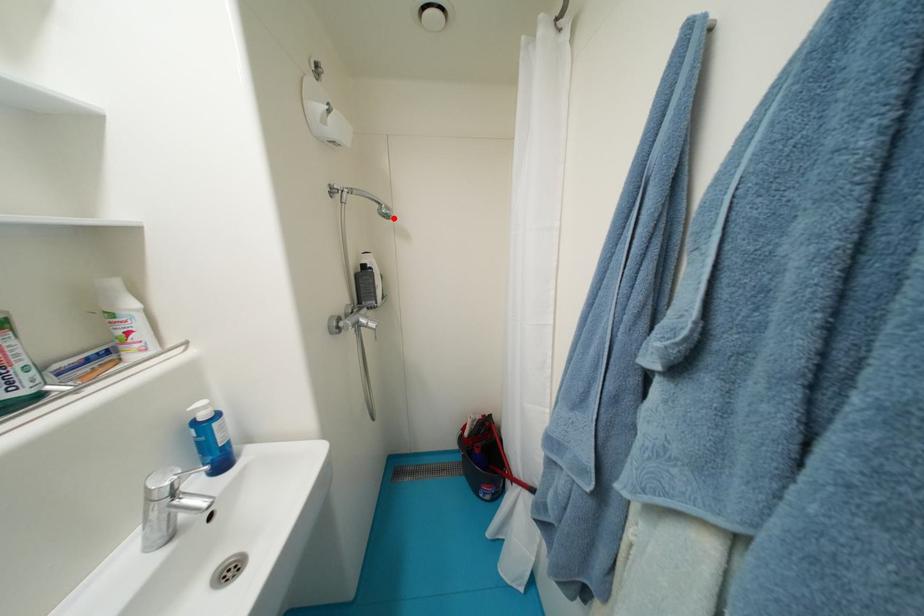
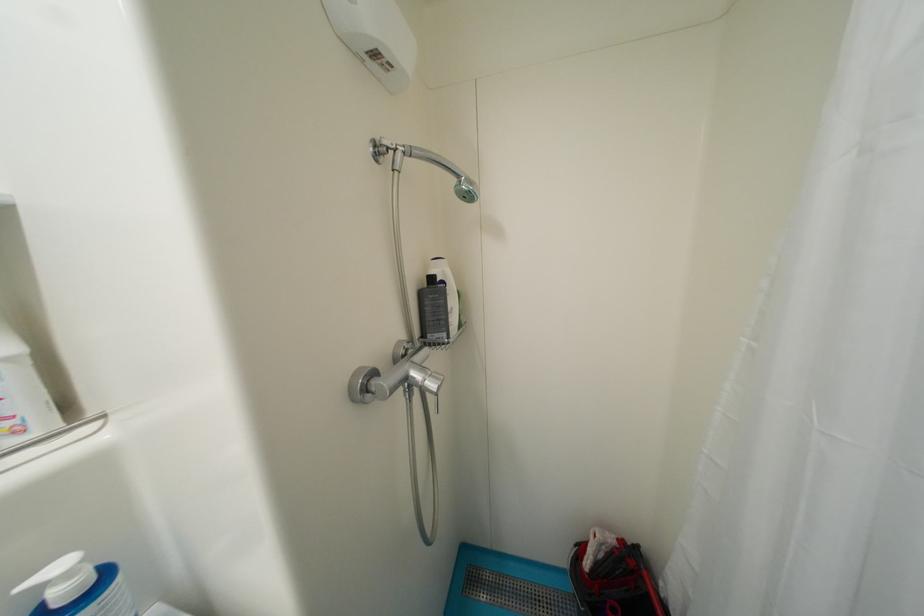
Where in the second image is the point corresponding to the highlighted location from the first image?

(476, 199)